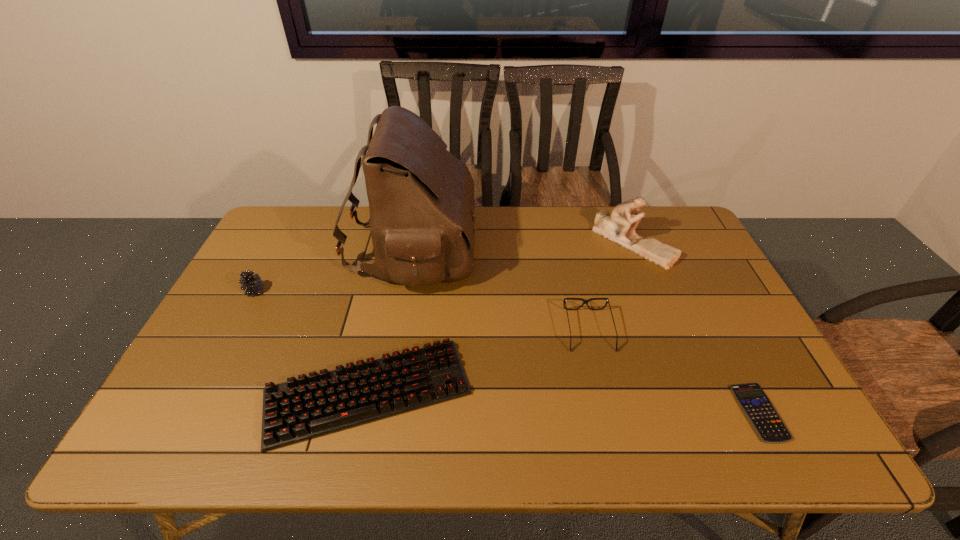
This screenshot has width=960, height=540. I want to click on vacant space located on the front of the leftmost object, so click(x=211, y=374).

The width and height of the screenshot is (960, 540). I want to click on free spot located with the lenses facing outward on the spectacles, so click(606, 404).

Locate an element on the screen. vacant space located on the right of the computer keyboard is located at coordinates (613, 392).

Identify the location of vacant space located on the left of the calculator. This screenshot has width=960, height=540. (715, 413).

Identify the location of satchel present at the far edge. (421, 199).

I want to click on figurine that is at the far edge, so click(619, 227).

The image size is (960, 540). I want to click on computer keyboard situated at the near edge, so click(x=300, y=409).

Identify the location of calculator that is positioned at the near edge. Image resolution: width=960 pixels, height=540 pixels. (759, 410).

Locate an element on the screen. The height and width of the screenshot is (540, 960). object at the left edge is located at coordinates (253, 284).

Image resolution: width=960 pixels, height=540 pixels. I want to click on figurine at the right edge, so click(619, 227).